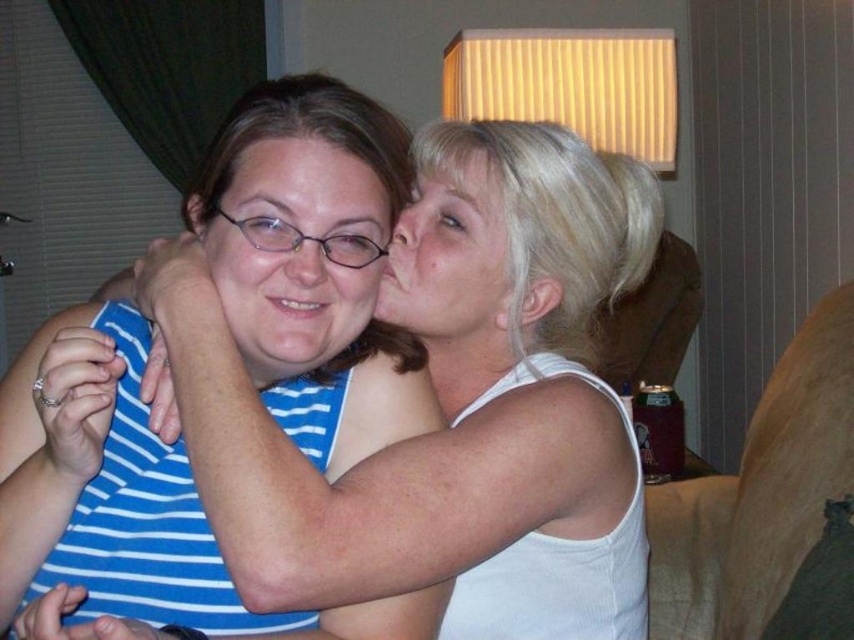
Question: Based on their relative distances, which object is farther from the matte blue striped shirt at center?

Choices:
 (A) matte white face at upper right
 (B) white matte tank top at center

Answer: (B)

Question: Is white matte tank top at center to the left of matte blue striped shirt at center from the viewer's perspective?

Choices:
 (A) no
 (B) yes

Answer: (A)

Question: Can you confirm if white matte tank top at center is bigger than matte white face at upper right?

Choices:
 (A) no
 (B) yes

Answer: (B)

Question: Among these objects, which one is farthest from the camera?

Choices:
 (A) matte white face at upper right
 (B) white matte tank top at center

Answer: (A)

Question: Is white matte tank top at center to the left of matte blue striped shirt at center from the viewer's perspective?

Choices:
 (A) no
 (B) yes

Answer: (A)

Question: Which is nearer to the matte blue striped shirt at center?

Choices:
 (A) white matte tank top at center
 (B) matte white face at upper right

Answer: (B)